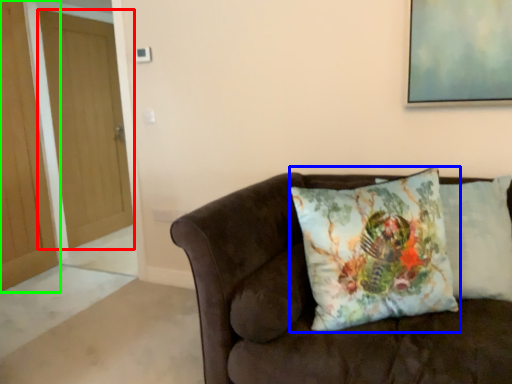
Question: Which object is positioned farthest from door (highlighted by a red box)? Select from pillow (highlighted by a blue box) and door (highlighted by a green box).

Choices:
 (A) pillow
 (B) door

Answer: (A)